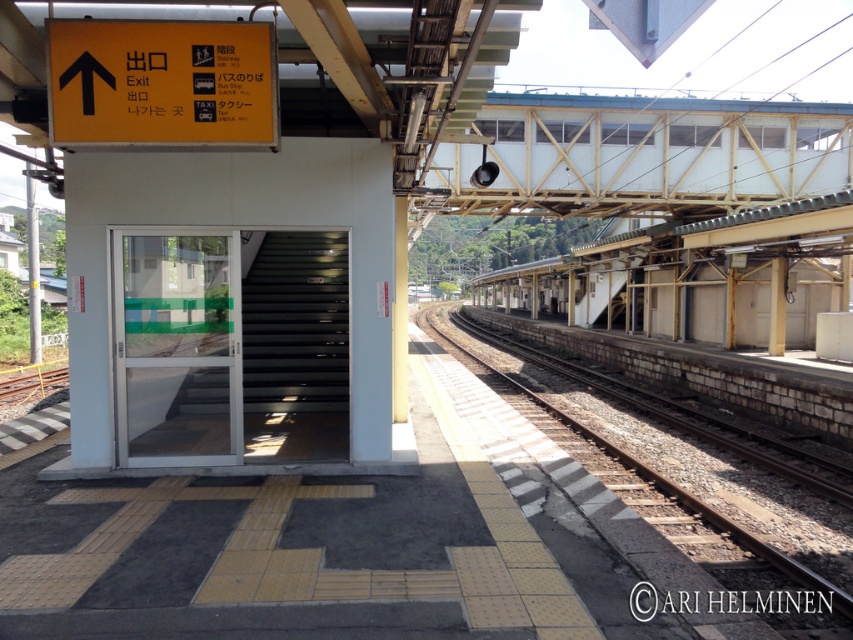
You are standing on the train station platform and want to know which point is closer to you. The points are point 1 at coordinate (595, 152) and point 2 at coordinate (238, 132). Which point is closer to your current position?

Point 2 at coordinate (238, 132) is closer to you because it is less further to the camera than point 1 at coordinate (595, 152).